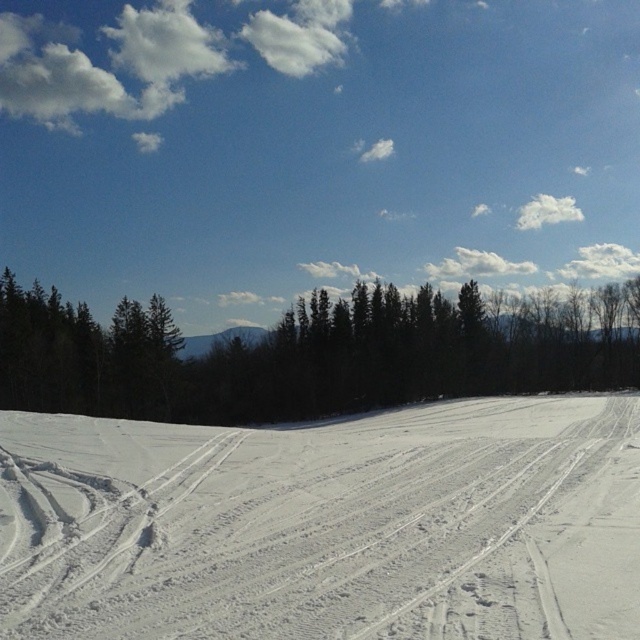
Question: Is white powdery snow at center wider than green matte trees at center?

Choices:
 (A) yes
 (B) no

Answer: (B)

Question: Is white powdery snow at center to the right of green matte trees at center from the viewer's perspective?

Choices:
 (A) no
 (B) yes

Answer: (B)

Question: Can you confirm if white powdery snow at center is wider than green matte trees at center?

Choices:
 (A) yes
 (B) no

Answer: (B)